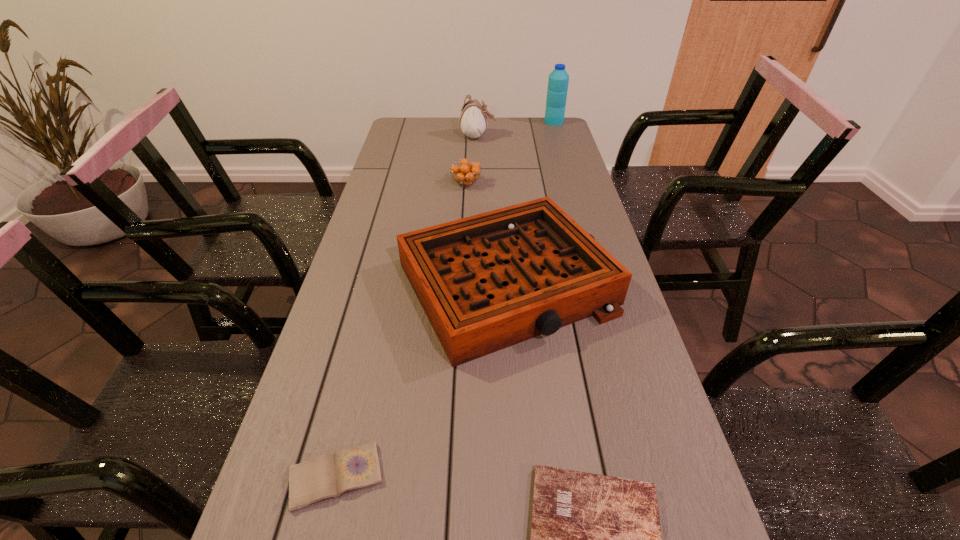
Locate which object is the third closest to the shortest object. Please provide its 2D coordinates. Your answer should be formatted as a tuple, i.e. [(x, y)], where the tuple contains the x and y coordinates of a point satisfying the conditions above.

[(466, 173)]

Identify which object is the fifth nearest to the Bible. Please provide its 2D coordinates. Your answer should be formatted as a tuple, i.e. [(x, y)], where the tuple contains the x and y coordinates of a point satisfying the conditions above.

[(558, 80)]

You are a GUI agent. You are given a task and a screenshot of the screen. Output one action in this format:
    pyautogui.click(x=<x>, y=<y>)
    Task: Click on the free space that satisfies the following two spatial constraints: 1. on the back side of the farthest object; 2. on the left side of the fourth shortest object
    The height and width of the screenshot is (540, 960).
    Given the screenshot: What is the action you would take?
    pyautogui.click(x=496, y=122)

Locate an element on the screen. This screenshot has height=540, width=960. vacant point that satisfies the following two spatial constraints: 1. on the back side of the fourth nearest object; 2. on the left side of the farthest object is located at coordinates (468, 122).

Locate an element on the screen. free space that satisfies the following two spatial constraints: 1. on the front side of the farthest object; 2. on the front-facing side of the second tallest object is located at coordinates (559, 137).